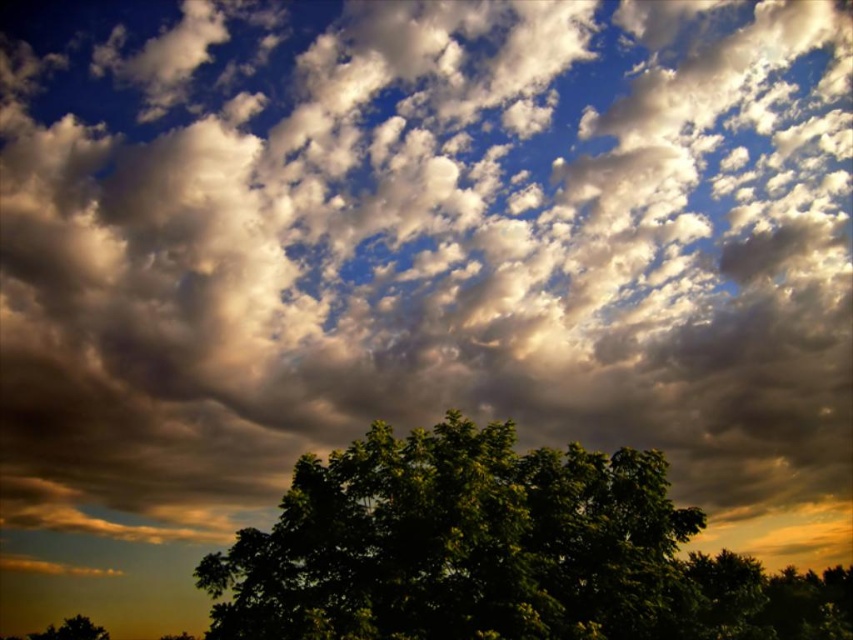
You are an observer looking at the two green leafy trees in the scene. Which tree is closer to you, the green leafy tree at center or the green leafy tree at lower center?

The green leafy tree at center is closer to you because it is positioned in front of the green leafy tree at lower center.

You are standing in a field and see the green leafy tree at center in the distance. If you want to take a photo of it with your smartphone, which has a maximum zoom range of 10x, will you be able to capture the tree clearly without moving closer?

The green leafy tree at center is 37.48 feet away from you. Since smartphones typically have a maximum zoom range that allows clear photos up to about 30 feet, you might experience some blurriness or loss of detail when zooming in at this distance. It is recommended to move closer to ensure a clearer photo.

You are an observer looking at the sky with two green leafy trees in the foreground. Which tree is more to the right? The green leafy tree at center or the green leafy tree at lower center?

The green leafy tree at center is positioned on the right side of green leafy tree at lower center, so the green leafy tree at center is more to the right.